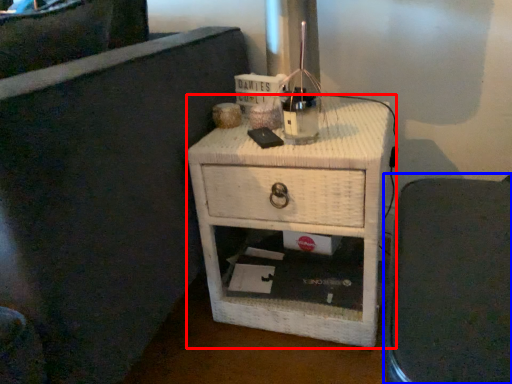
Question: Among these objects, which one is nearest to the camera, nightstand (highlighted by a red box) or furniture (highlighted by a blue box)?

Choices:
 (A) nightstand
 (B) furniture

Answer: (B)